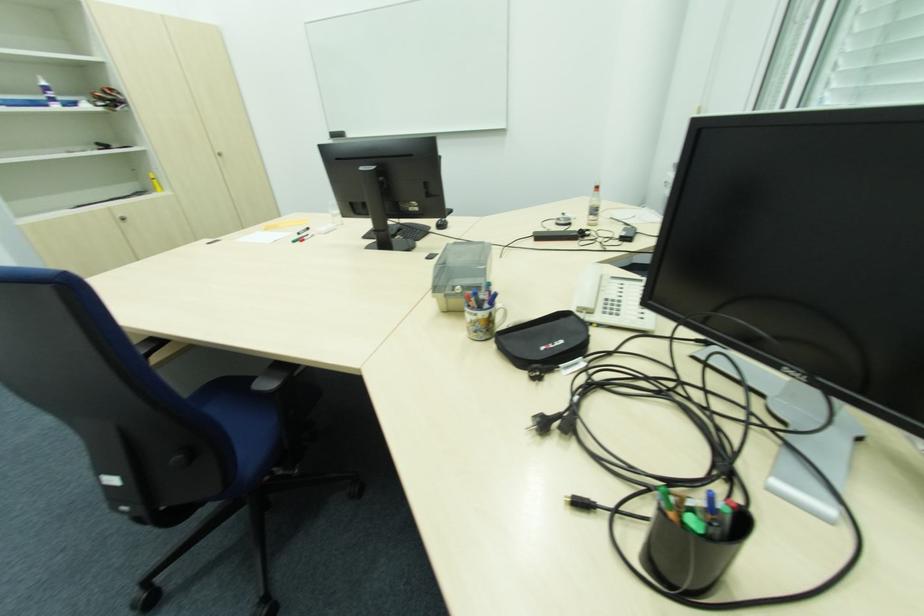
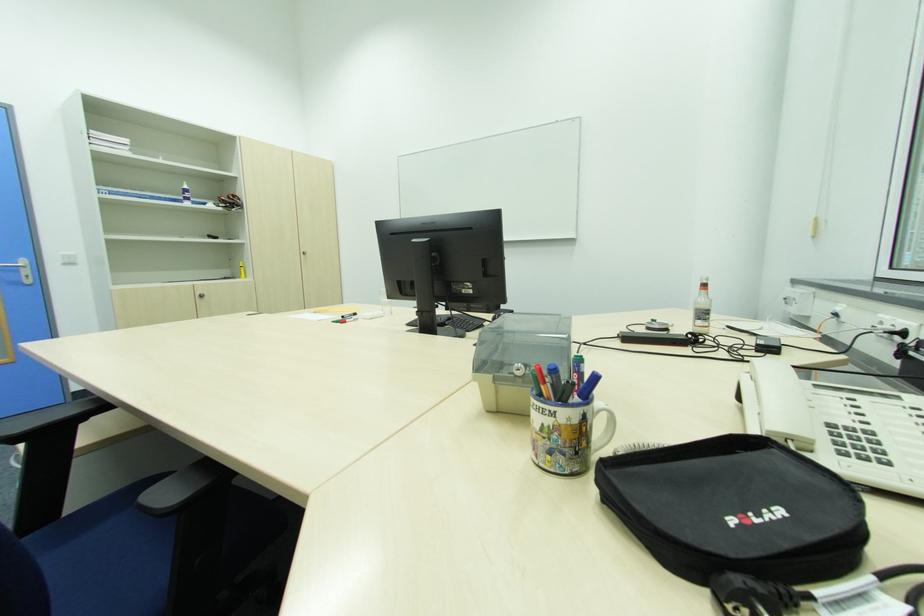
Question: Based on the continuous images, in which direction is the camera rotating? Reply with the corresponding letter.

Choices:
 (A) Left
 (B) Right
 (C) Up
 (D) Down

Answer: (C)